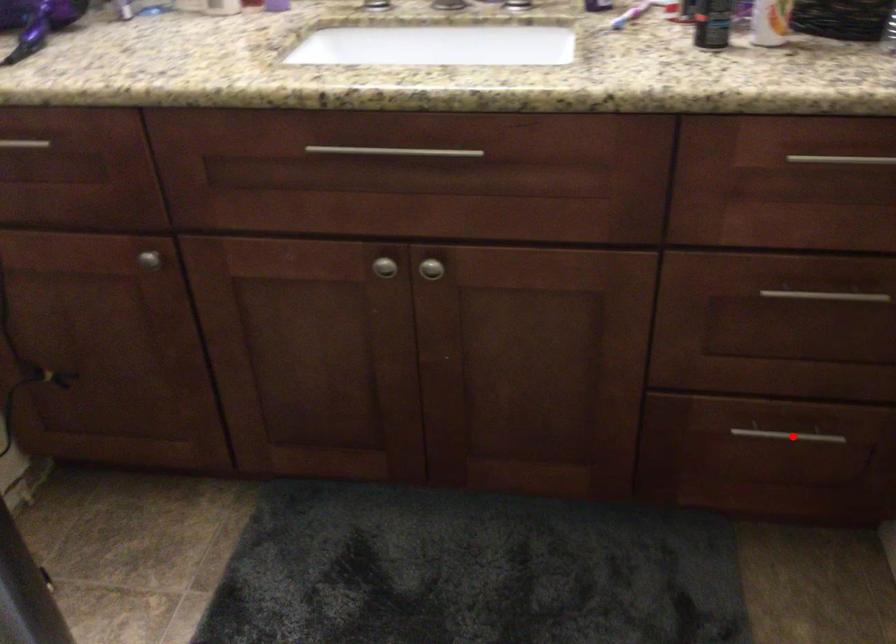
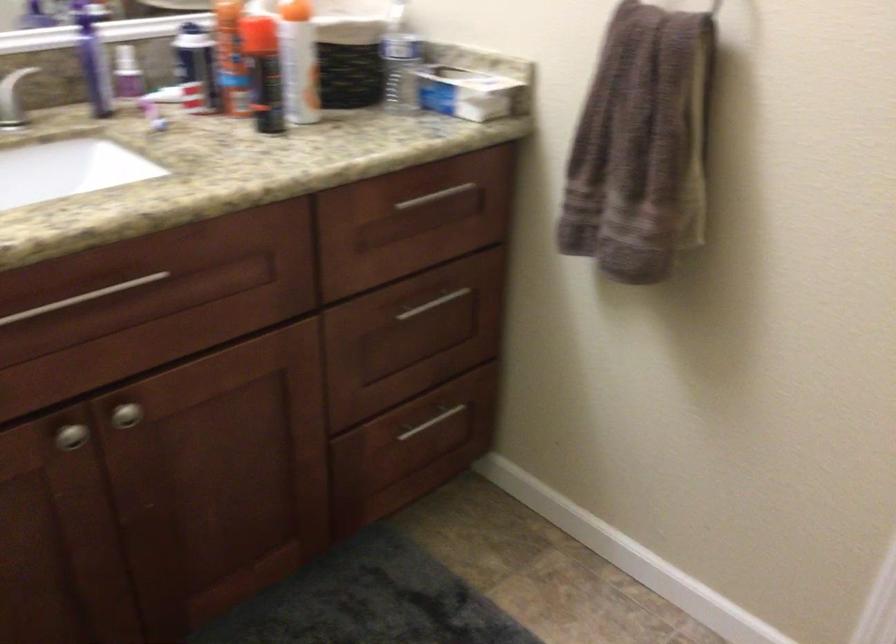
Question: A red point is marked in image1. In image2, is the corresponding 3D point closer to the camera or farther? Reply with the corresponding letter.

Choices:
 (A) The corresponding 3D point is closer.
 (B) The corresponding 3D point is farther.

Answer: (B)